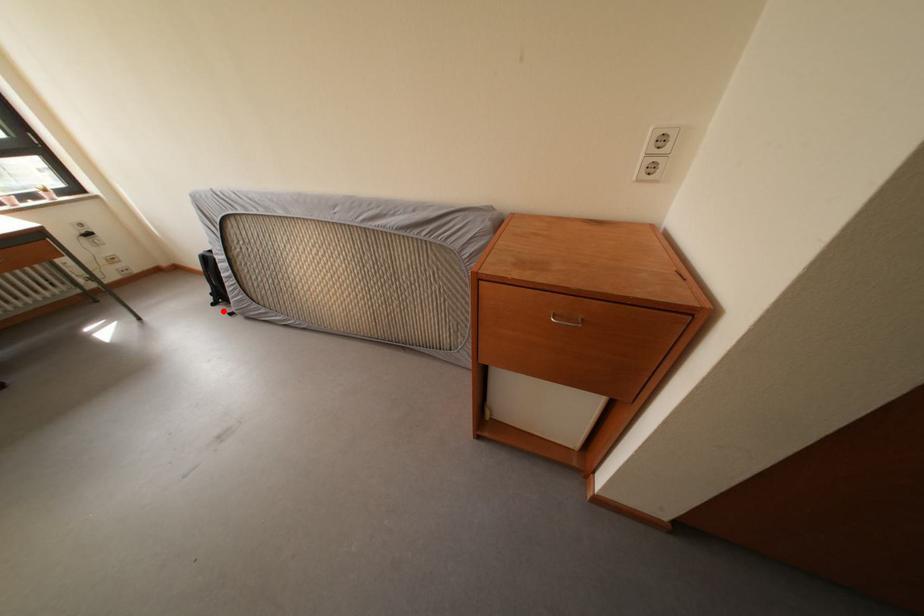
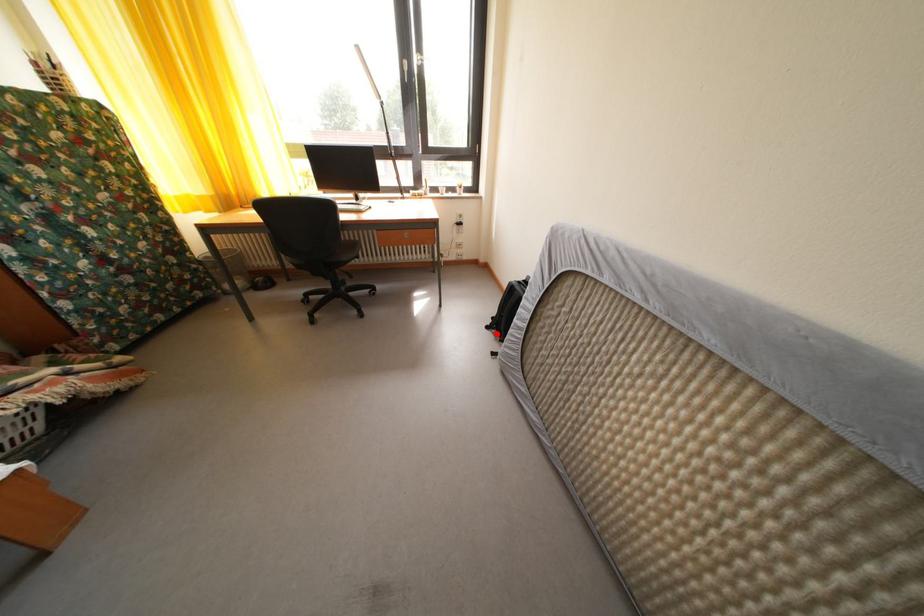
I am providing you with two images of the same scene from different viewpoints. A red point is marked on the first image and another point is marked on the second image. Is the red point in image1 aligned with the point shown in image2?

Yes